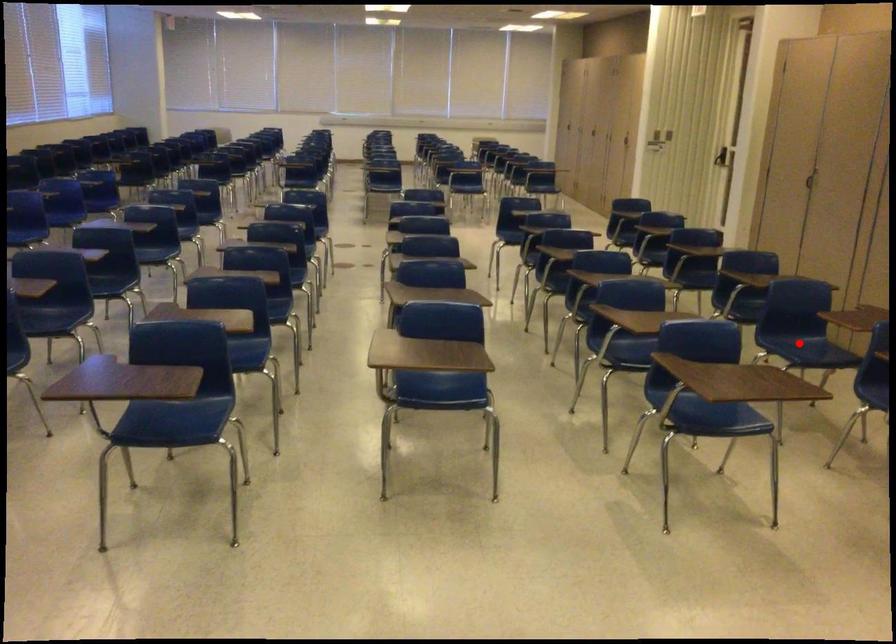
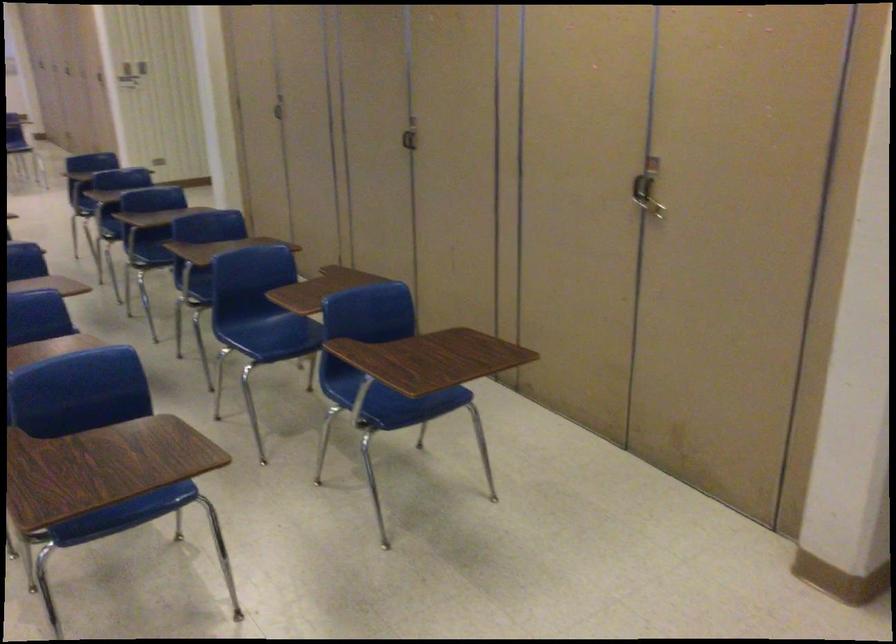
Question: A red point is marked in image1. In image2, is the corresponding 3D point closer to the camera or farther? Reply with the corresponding letter.

Choices:
 (A) The corresponding 3D point is closer.
 (B) The corresponding 3D point is farther.

Answer: (A)